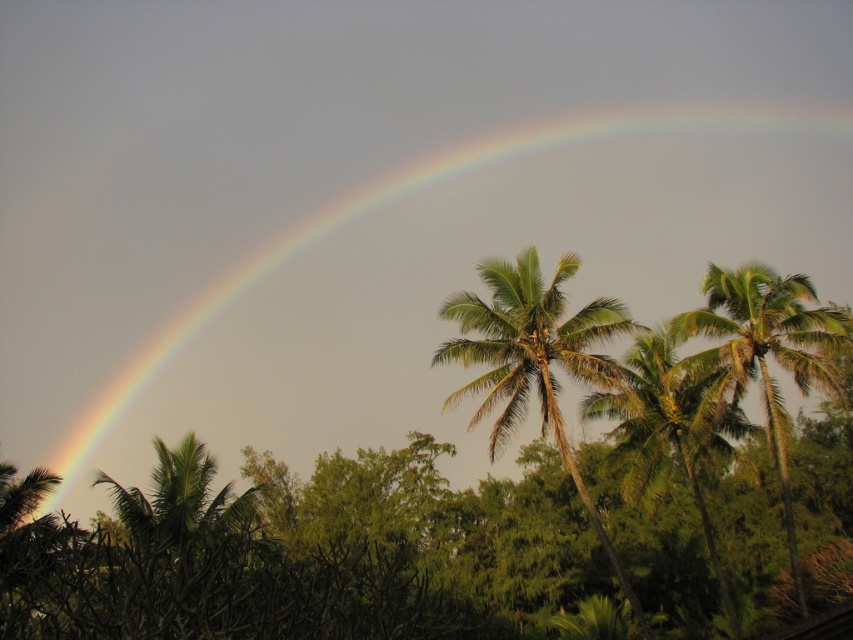
Question: Which object is farther from the camera taking this photo?

Choices:
 (A) green leafy palm at upper right
 (B) green leafy palm tree at center
 (C) green leafy palm at center
 (D) rainbow at upper left

Answer: (D)

Question: Does rainbow at upper left have a larger size compared to green leafy palm at upper right?

Choices:
 (A) yes
 (B) no

Answer: (A)

Question: Which point is farther to the camera?

Choices:
 (A) (692, 412)
 (B) (733, 289)
 (C) (521, 269)
 (D) (250, 426)

Answer: (D)

Question: Does rainbow at upper left have a lesser width compared to green leafy palm at upper right?

Choices:
 (A) no
 (B) yes

Answer: (A)

Question: Which point appears farthest from the camera in this image?

Choices:
 (A) (476, 326)
 (B) (431, 426)
 (C) (614, 397)
 (D) (703, 285)

Answer: (B)

Question: Is green leafy palm at upper right smaller than green leafy palm tree at center?

Choices:
 (A) yes
 (B) no

Answer: (B)